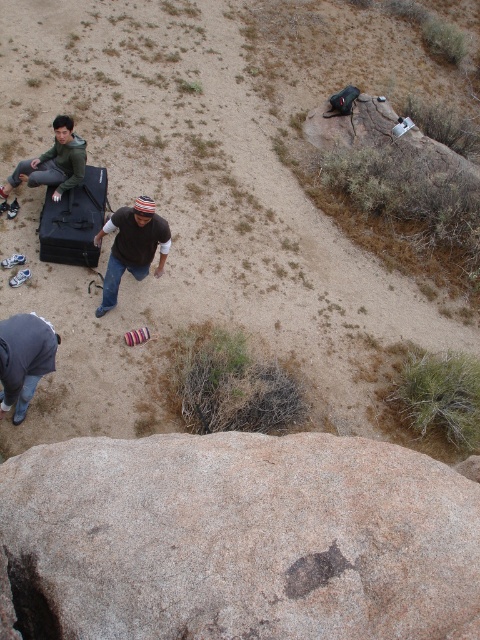
Between brown rough rock at bottom and gray fabric squat at lower left, which one is positioned higher?

gray fabric squat at lower left is above.

Is brown rough rock at bottom closer to camera compared to gray fabric squat at lower left?

Yes, brown rough rock at bottom is in front of gray fabric squat at lower left.

I want to click on brown rough rock at bottom, so click(x=239, y=538).

Is point (202, 20) closer to camera compared to point (37, 326)?

No, (202, 20) is further to viewer.

Does brown rock at center appear on the right side of gray fabric squat at lower left?

Yes, brown rock at center is to the right of gray fabric squat at lower left.

Is point (388, 342) positioned before point (52, 353)?

No, (388, 342) is further to viewer.

Image resolution: width=480 pixels, height=640 pixels. I want to click on brown rock at center, so click(191, 220).

Who is taller, brown rock at center or brown cotton shirt at center?

brown rock at center

Is point (337, 428) positioned behind point (148, 257)?

Yes.

Where is `brown rock at center`? brown rock at center is located at coordinates (191, 220).